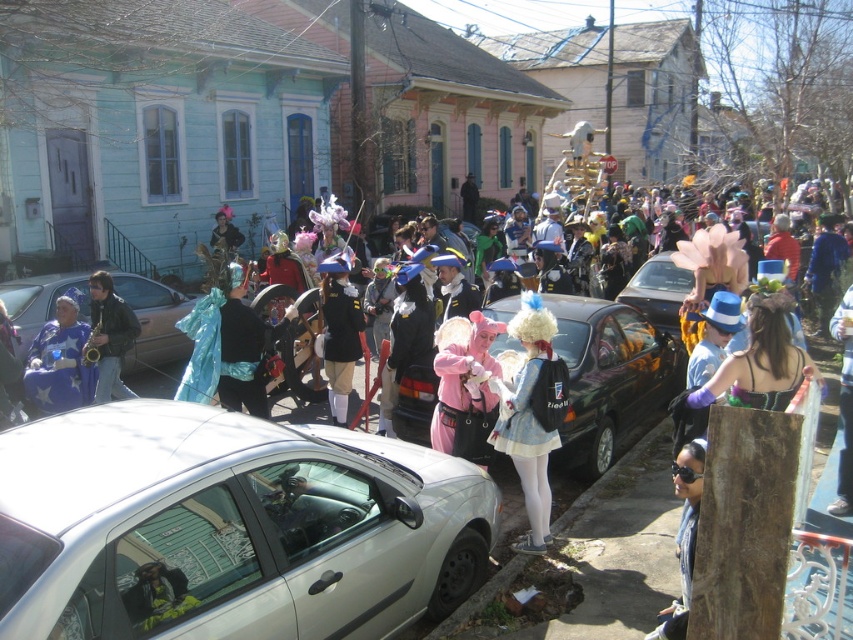
You are a photographer trying to capture the blue shiny fabric at center without including the black matte car at center in your shot. Based on their positions, is this possible?

The black matte car at center is below the blue shiny fabric at center, so you can position your camera to focus on the upper part of the blue shiny fabric at center while avoiding the lower area where the black matte car at center is located.

You are standing at the point closest to the saxophonist in the image. There are two points marked on the image, one at coordinates point (67, 339) and another at point (99, 340). Which point is closer to you?

Point (99, 340) is closer to you because it is in front of point (67, 339), which is behind it.